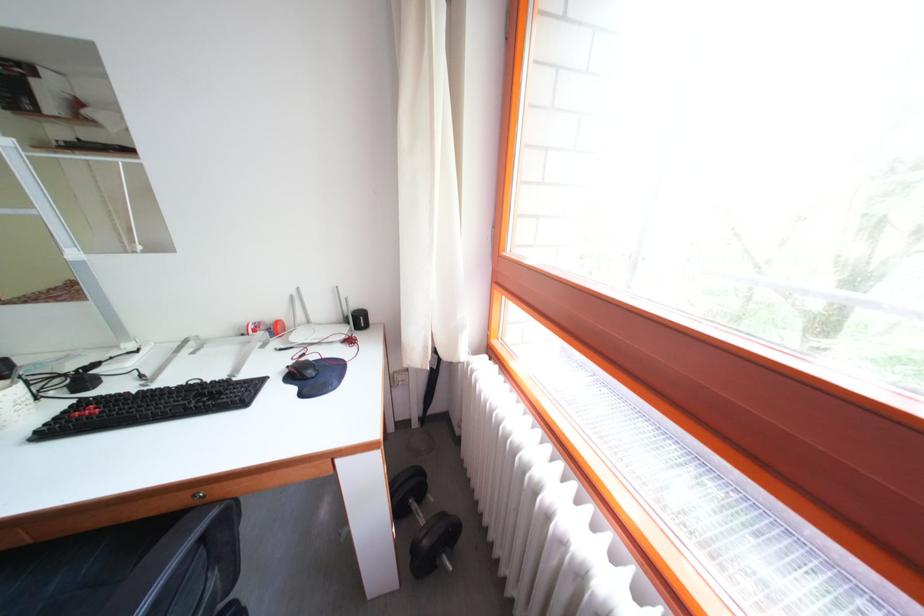
Where would you pull the round drawer handle? Please return your answer as a coordinate pair (x, y).

(199, 496)